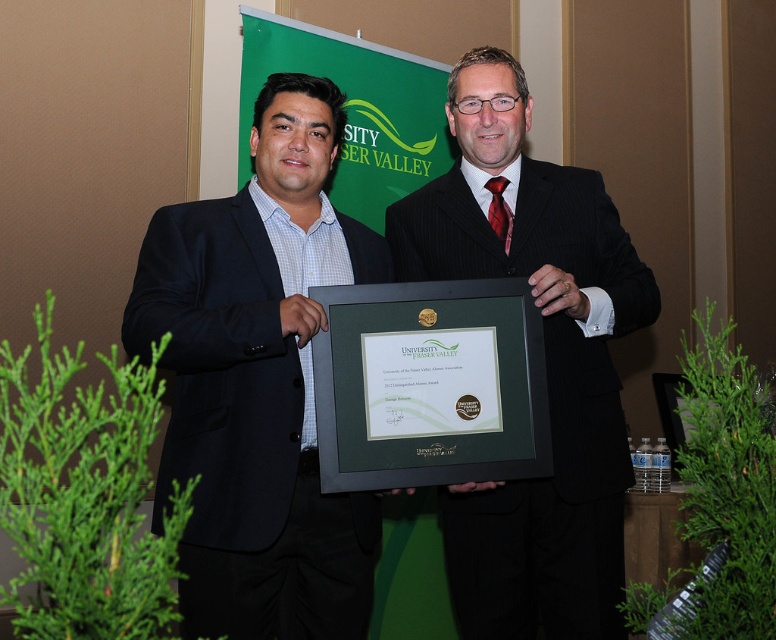
Question: Among these objects, which one is farthest from the camera?

Choices:
 (A) dark blue fabric business suit at center
 (B) green matte plaque at center
 (C) black pinstripe suit at center

Answer: (C)

Question: Is the position of black pinstripe suit at center less distant than that of dark blue fabric business suit at center?

Choices:
 (A) no
 (B) yes

Answer: (A)

Question: Does black pinstripe suit at center have a greater width compared to dark blue fabric business suit at center?

Choices:
 (A) no
 (B) yes

Answer: (B)

Question: Is dark blue fabric business suit at center closer to camera compared to green matte plaque at center?

Choices:
 (A) yes
 (B) no

Answer: (A)

Question: Which point appears closest to the camera in this image?

Choices:
 (A) (418, 378)
 (B) (269, 388)
 (C) (603, 506)

Answer: (A)

Question: Estimate the real-world distances between objects in this image. Which object is closer to the green matte plaque at center?

Choices:
 (A) dark blue fabric business suit at center
 (B) black pinstripe suit at center

Answer: (B)